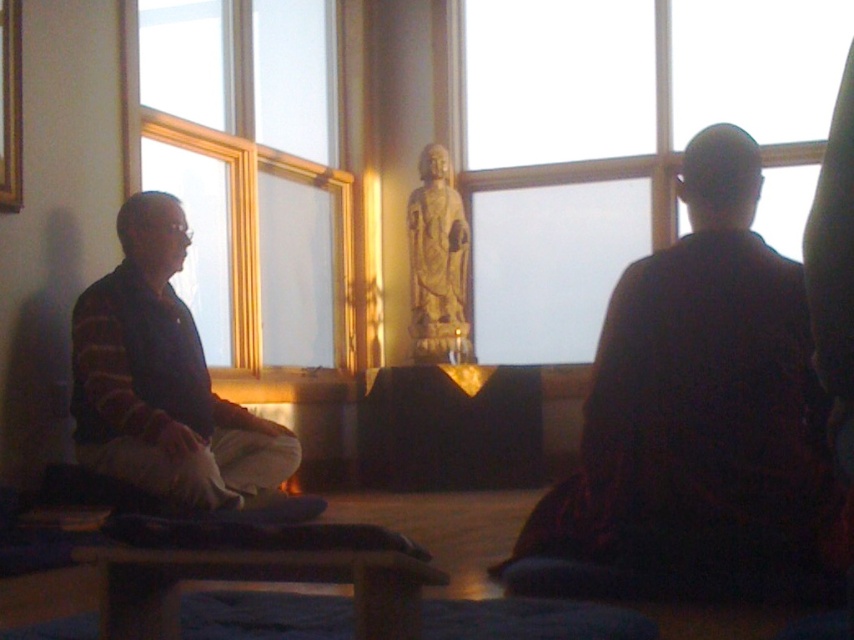
Between transparent glass window at upper left and stone statue at center, which one is positioned higher?

transparent glass window at upper left is above.

Does transparent glass window at upper left appear under stone statue at center?

No.

The height and width of the screenshot is (640, 854). What are the coordinates of `transparent glass window at upper left` in the screenshot? It's located at (249, 170).

Looking at this image, is transparent glass window at center to the left of transparent glass window at upper left from the viewer's perspective?

Incorrect, transparent glass window at center is not on the left side of transparent glass window at upper left.

Find the location of a particular element. Image resolution: width=854 pixels, height=640 pixels. transparent glass window at center is located at coordinates (619, 141).

Who is positioned more to the right, black velvet robe at right or stone statue at center?

From the viewer's perspective, black velvet robe at right appears more on the right side.

Is black velvet robe at right above stone statue at center?

No, black velvet robe at right is not above stone statue at center.

Where is `black velvet robe at right`? black velvet robe at right is located at coordinates (699, 419).